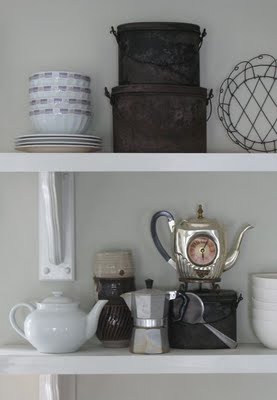
Image resolution: width=277 pixels, height=400 pixels. I want to click on white shelf, so click(163, 159), click(165, 364).